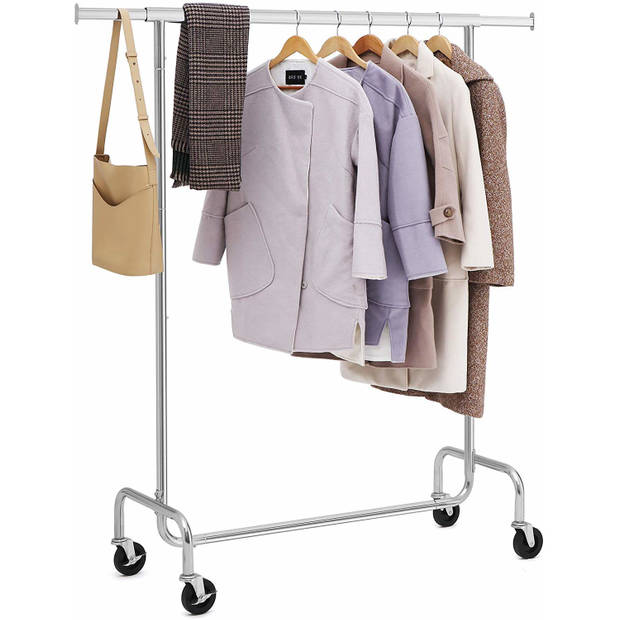
This screenshot has width=620, height=620. In order to click on hanger hooks in this screenshot , I will do `click(296, 17)`, `click(337, 16)`, `click(370, 16)`, `click(409, 14)`, `click(438, 15)`.